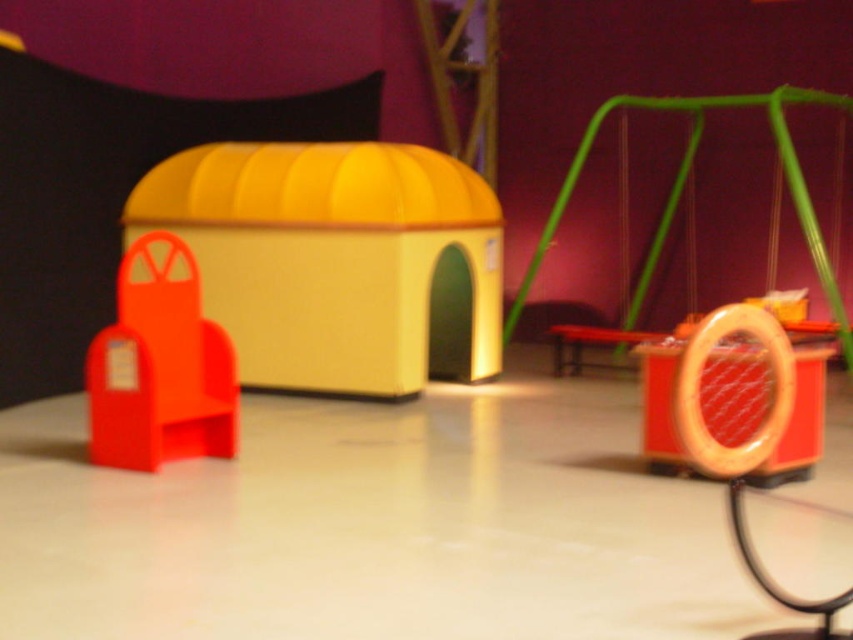
Question: Is yellow matte plastic house at center positioned before matte orange stool at center?

Choices:
 (A) no
 (B) yes

Answer: (B)

Question: Can you confirm if yellow matte plastic house at center is wider than orange matte bookend at left?

Choices:
 (A) yes
 (B) no

Answer: (A)

Question: Which object appears farthest from the camera in this image?

Choices:
 (A) matte orange stool at center
 (B) orange matte bookend at left

Answer: (A)

Question: Which point is closer to the camera?

Choices:
 (A) orange matte bookend at left
 (B) yellow matte plastic house at center
 (C) matte orange stool at center

Answer: (A)

Question: Which point is closer to the camera taking this photo?

Choices:
 (A) (178, 362)
 (B) (567, 324)
 (C) (397, 243)

Answer: (A)

Question: Is yellow matte plastic house at center smaller than matte orange stool at center?

Choices:
 (A) no
 (B) yes

Answer: (A)